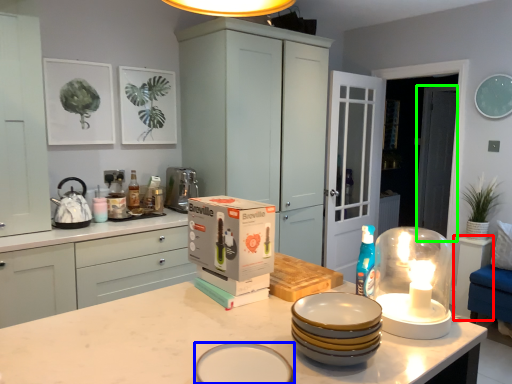
Question: Which object is the closest to the table (highlighted by a red box)? Choose among these: tableware (highlighted by a blue box) or glass door (highlighted by a green box).

Choices:
 (A) tableware
 (B) glass door

Answer: (B)